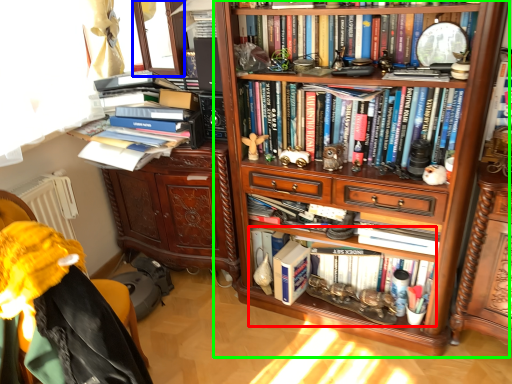
Question: Which object is the closest to the book (highlighted by a red box)? Choose among these: window screen (highlighted by a blue box) or bookcase (highlighted by a green box).

Choices:
 (A) window screen
 (B) bookcase

Answer: (B)